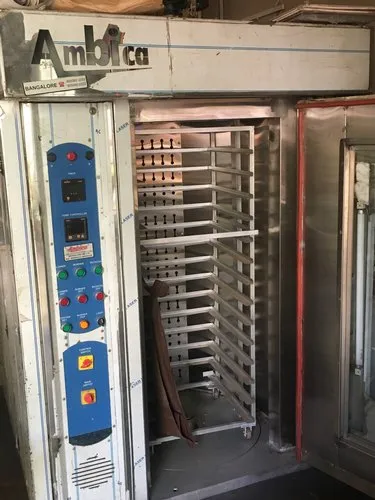
Identify the location of rack. (244, 236).